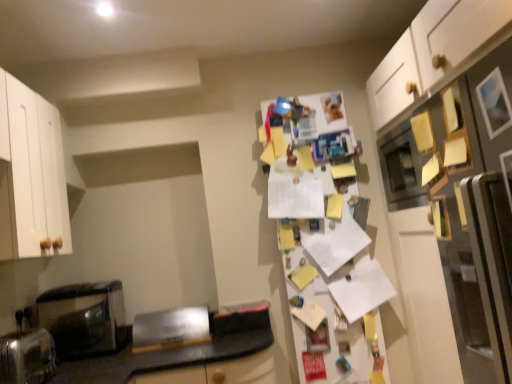
Question: Can you confirm if black glossy microwave at left is shorter than brushed metal toaster at lower left, the 1th appliance from the back?

Choices:
 (A) no
 (B) yes

Answer: (A)

Question: Is black glossy microwave at left oriented away from brushed metal toaster at lower left, which is the 2th appliance from front to back?

Choices:
 (A) yes
 (B) no

Answer: (B)

Question: Is black glossy microwave at left not inside brushed metal toaster at lower left, the 1th appliance from the back?

Choices:
 (A) no
 (B) yes

Answer: (B)

Question: Is black glossy microwave at left far away from brushed metal toaster at lower left, the 2th appliance viewed from the left?

Choices:
 (A) yes
 (B) no

Answer: (B)

Question: Is black glossy microwave at left oriented towards brushed metal toaster at lower left, the 2th appliance viewed from the left?

Choices:
 (A) yes
 (B) no

Answer: (B)

Question: Is satin silver toaster at lower left, arranged as the second appliance when viewed from the back, inside or outside of white paper covered fridge at center, the 2th fridge from the right?

Choices:
 (A) outside
 (B) inside

Answer: (A)

Question: Looking at their shapes, would you say satin silver toaster at lower left, arranged as the second appliance when viewed from the back, is wider or thinner than white paper covered fridge at center, which ranks as the 1th fridge in back-to-front order?

Choices:
 (A) wide
 (B) thin

Answer: (A)

Question: From a real-world perspective, is satin silver toaster at lower left, arranged as the second appliance when viewed from the back, positioned above or below white paper covered fridge at center, the first fridge positioned from the left?

Choices:
 (A) above
 (B) below

Answer: (B)

Question: Visually, is satin silver toaster at lower left, marked as the 2th appliance in a right-to-left arrangement, positioned to the left or to the right of white paper covered fridge at center, the first fridge positioned from the left?

Choices:
 (A) left
 (B) right

Answer: (A)

Question: Is satin silver toaster at lower left, marked as the 2th appliance in a right-to-left arrangement, to the left or to the right of brushed metal toaster at lower left, the 1th appliance from the back, in the image?

Choices:
 (A) right
 (B) left

Answer: (B)

Question: Is satin silver toaster at lower left, marked as the 2th appliance in a right-to-left arrangement, spatially inside brushed metal toaster at lower left, which is the first appliance from right to left, or outside of it?

Choices:
 (A) outside
 (B) inside

Answer: (A)

Question: In terms of height, does satin silver toaster at lower left, arranged as the second appliance when viewed from the back, look taller or shorter compared to brushed metal toaster at lower left, the 1th appliance from the back?

Choices:
 (A) short
 (B) tall

Answer: (B)

Question: From the image's perspective, is satin silver toaster at lower left, the first appliance viewed from the left, above or below brushed metal toaster at lower left, the 1th appliance from the back?

Choices:
 (A) below
 (B) above

Answer: (B)

Question: From the image's perspective, is white paper covered fridge at center, which ranks as the 1th fridge in back-to-front order, located above or below satin silver toaster at lower left, arranged as the second appliance when viewed from the back?

Choices:
 (A) above
 (B) below

Answer: (A)

Question: Looking at their shapes, would you say white paper covered fridge at center, the first fridge positioned from the left, is wider or thinner than satin silver toaster at lower left, marked as the 2th appliance in a right-to-left arrangement?

Choices:
 (A) thin
 (B) wide

Answer: (A)